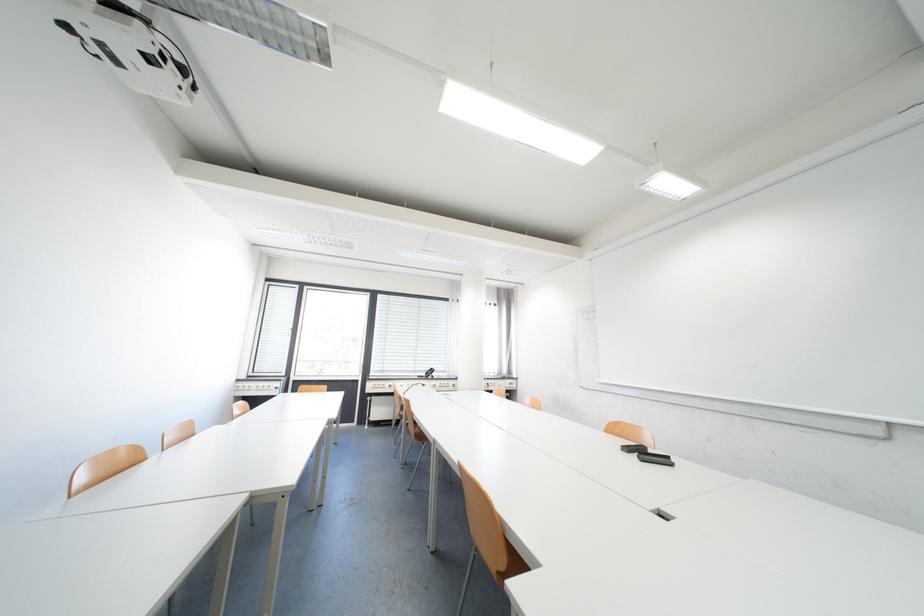
This screenshot has width=924, height=616. What do you see at coordinates (429, 371) in the screenshot? I see `the telephone handset` at bounding box center [429, 371].